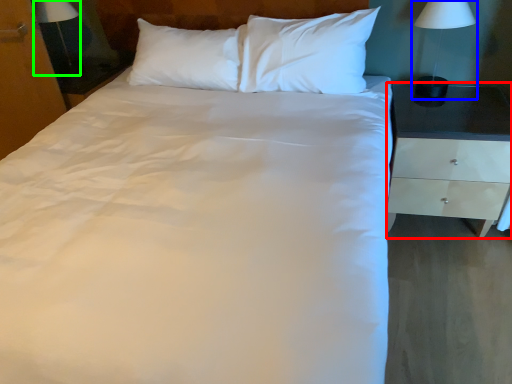
Question: Based on their relative distances, which object is farther from nightstand (highlighted by a red box)? Choose from bedside lamp (highlighted by a blue box) and bedside lamp (highlighted by a green box).

Choices:
 (A) bedside lamp
 (B) bedside lamp

Answer: (B)